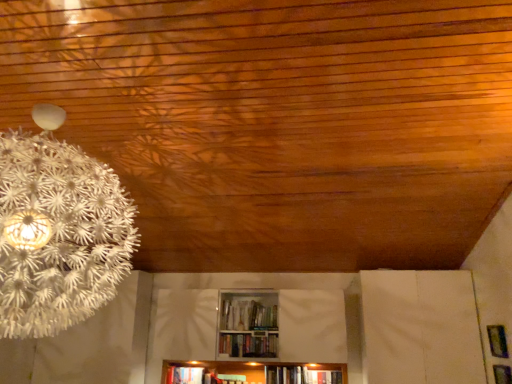
Question: Are hardcover book at lower center, marked as the 2th book in a front-to-back arrangement, and hardcover book at center, positioned as the second book in back-to-front order, located far from each other?

Choices:
 (A) yes
 (B) no

Answer: (B)

Question: From the image's perspective, would you say hardcover book at lower center, marked as the 2th book in a front-to-back arrangement, is positioned over hardcover book at center, marked as the 1th book in a right-to-left arrangement?

Choices:
 (A) no
 (B) yes

Answer: (A)

Question: Is hardcover book at center, the 1th book from the top, inside hardcover book at lower center, placed as the 1th book when sorted from bottom to top?

Choices:
 (A) yes
 (B) no

Answer: (B)

Question: Is hardcover book at lower center, which is the second book in top-to-bottom order, oriented away from hardcover book at center, the 1th book from the top?

Choices:
 (A) yes
 (B) no

Answer: (B)

Question: Is hardcover book at lower center, marked as the 2th book in a front-to-back arrangement, beside hardcover book at center, the 1th book from the top?

Choices:
 (A) yes
 (B) no

Answer: (B)

Question: Does hardcover book at lower center, placed as the 1th book when sorted from bottom to top, turn towards hardcover book at center, arranged as the 2th book when ordered from the bottom?

Choices:
 (A) no
 (B) yes

Answer: (A)

Question: Does metallic silver frame at lower right have a greater width compared to hardcover book at lower center, the 1th book from the back?

Choices:
 (A) no
 (B) yes

Answer: (A)

Question: Is metallic silver frame at lower right positioned behind hardcover book at lower center, marked as the 2th book in a front-to-back arrangement?

Choices:
 (A) no
 (B) yes

Answer: (A)

Question: Is metallic silver frame at lower right with hardcover book at lower center, the second book from the right?

Choices:
 (A) no
 (B) yes

Answer: (A)

Question: Is metallic silver frame at lower right positioned far away from hardcover book at lower center, the 1th book when ordered from left to right?

Choices:
 (A) yes
 (B) no

Answer: (A)

Question: From the image's perspective, is metallic silver frame at lower right over hardcover book at lower center, the second book from the right?

Choices:
 (A) no
 (B) yes

Answer: (B)

Question: From a real-world perspective, is metallic silver frame at lower right physically above hardcover book at lower center, placed as the 1th book when sorted from bottom to top?

Choices:
 (A) no
 (B) yes

Answer: (B)

Question: Does hardcover book at lower center, the 1th book when ordered from left to right, appear on the left side of metallic silver frame at lower right?

Choices:
 (A) yes
 (B) no

Answer: (A)